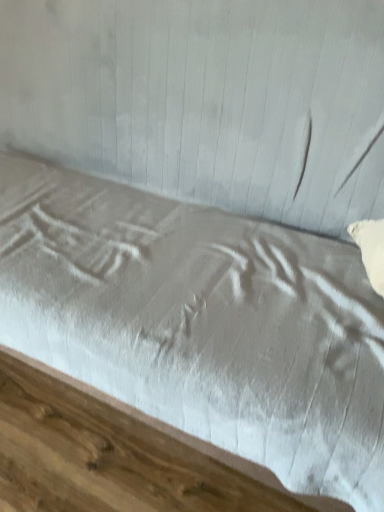
What is the approximate height of white fabric bed at center?

It is 95.22 centimeters.

You are a GUI agent. You are given a task and a screenshot of the screen. Output one action in this format:
    pyautogui.click(x=<x>, y=<y>)
    Task: Click on the white fabric bed at center
    The image size is (384, 512).
    Given the screenshot: What is the action you would take?
    pyautogui.click(x=201, y=322)

What do you see at coordinates (201, 322) in the screenshot? I see `white fabric bed at center` at bounding box center [201, 322].

Locate an element on the screen. The image size is (384, 512). white fabric bed at center is located at coordinates (201, 322).